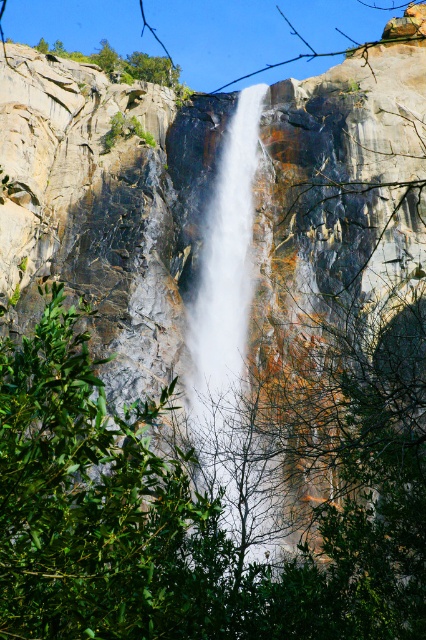
You are a hiker standing at the base of the cliff. You see the green leafy tree at lower left and the white smooth waterfall at center. Which object is wider from your perspective?

The green leafy tree at lower left is wider than the white smooth waterfall at center from your perspective.

You are standing at the base of the waterfall and want to take a photo. There are two points marked in the image, point A at coordinates point (386,582) and point B at coordinates point (233,406). Which point is closer to your camera position?

Point A at coordinates point (386,582) is closer to the camera than point B at coordinates point (233,406).

From the picture: You are standing at the edge of the cliff looking down at the scene. You see the green leafy tree at lower left and the white smooth waterfall at center. Which object is positioned to the left of the other?

The green leafy tree at lower left is to the left of the white smooth waterfall at center.